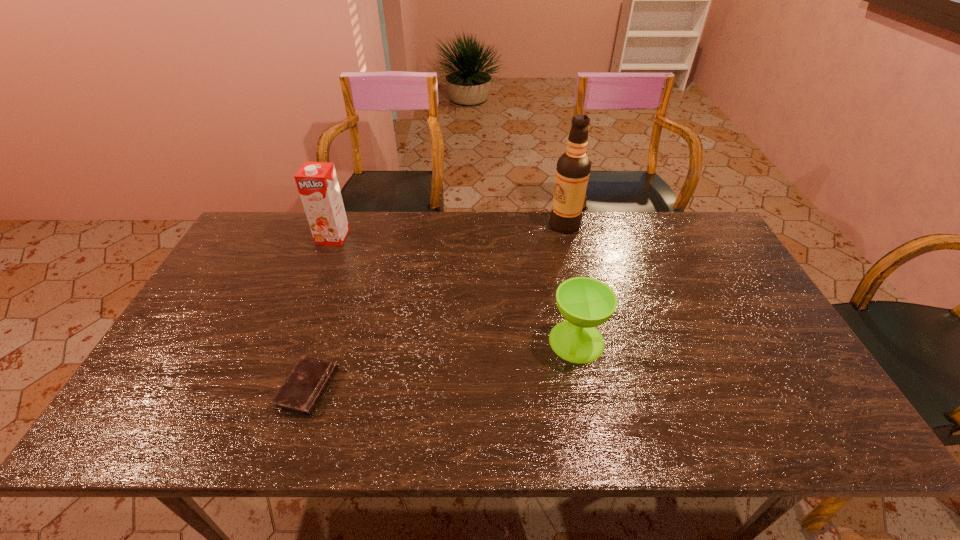
Find the location of a particular element. alcohol positioned at the far edge is located at coordinates (573, 168).

This screenshot has width=960, height=540. I want to click on carton located at the far edge, so click(317, 183).

You are a GUI agent. You are given a task and a screenshot of the screen. Output one action in this format:
    pyautogui.click(x=<x>, y=<y>)
    Task: Click on the object situated at the near edge
    
    Given the screenshot: What is the action you would take?
    pos(300,393)

What are the coordinates of `free location at the far edge of the desktop` in the screenshot? It's located at (425, 225).

Locate an element on the screen. This screenshot has height=540, width=960. free space at the left edge of the desktop is located at coordinates (204, 352).

Where is `vacant space at the right edge of the desktop`? The height and width of the screenshot is (540, 960). vacant space at the right edge of the desktop is located at coordinates (736, 344).

Locate an element on the screen. free space at the far left corner of the desktop is located at coordinates (270, 230).

Identify the location of vacant space at the near left corner of the desktop. The height and width of the screenshot is (540, 960). (182, 411).

Where is `vacant region at the far right corner of the desktop`? Image resolution: width=960 pixels, height=540 pixels. vacant region at the far right corner of the desktop is located at coordinates (730, 254).

Where is `free space that is in between the alcohol and the shortest object`? This screenshot has width=960, height=540. free space that is in between the alcohol and the shortest object is located at coordinates (436, 307).